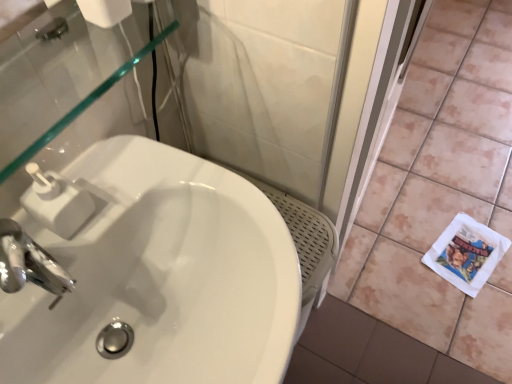
Find the location of a particular element. This screenshot has width=512, height=384. vacant area located to the right-hand side of white plastic soap dispenser at upper left is located at coordinates (148, 193).